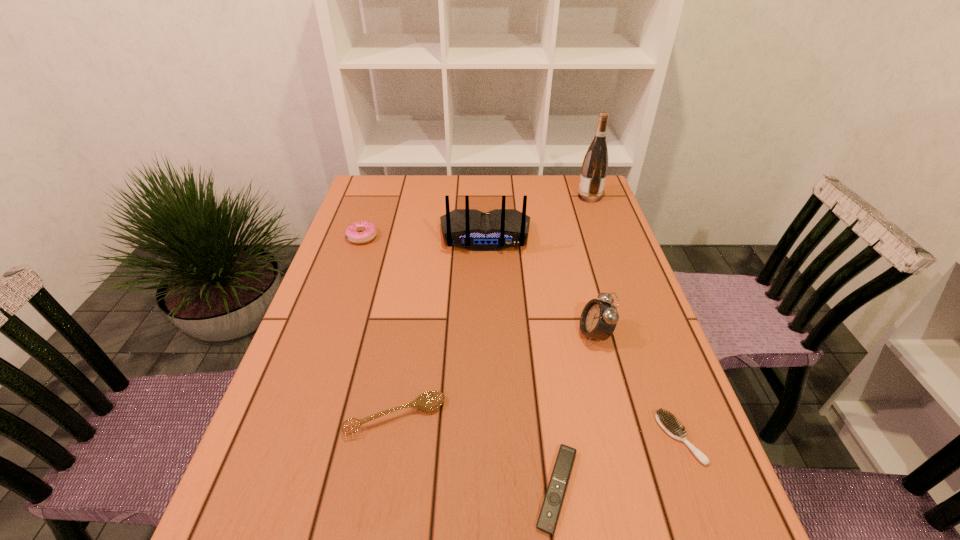
The height and width of the screenshot is (540, 960). In order to click on object that can be found as the sixth closest to the wine bottle in this screenshot , I will do `click(551, 507)`.

Image resolution: width=960 pixels, height=540 pixels. Identify the location of the closest object relative to the fourth nearest object. (667, 422).

You are a GUI agent. You are given a task and a screenshot of the screen. Output one action in this format:
    pyautogui.click(x=<x>, y=<y>)
    Task: Click on the vacant space that satisfies the following two spatial constraints: 1. on the back side of the scrubbing brush; 2. on the label of the tallest object
    The width and height of the screenshot is (960, 540).
    Given the screenshot: What is the action you would take?
    pyautogui.click(x=591, y=197)

What are the coordinates of `vacant space that satisfies the following two spatial constraints: 1. on the label of the farthest object; 2. on the back of the router` in the screenshot? It's located at (603, 235).

Locate an element on the screen. The height and width of the screenshot is (540, 960). vacant space that satisfies the following two spatial constraints: 1. on the face of the fourth farthest object; 2. on the left side of the scrubbing brush is located at coordinates (622, 438).

Where is `free point that satisfies the following two spatial constraints: 1. on the face of the fifth shortest object; 2. on the front side of the ladle`? The width and height of the screenshot is (960, 540). free point that satisfies the following two spatial constraints: 1. on the face of the fifth shortest object; 2. on the front side of the ladle is located at coordinates (616, 416).

You are a GUI agent. You are given a task and a screenshot of the screen. Output one action in this format:
    pyautogui.click(x=<x>, y=<y>)
    Task: Click on the free space that satisfies the following two spatial constraints: 1. on the label of the tallest object; 2. on the back of the second tallest object
    Image resolution: width=960 pixels, height=540 pixels.
    Given the screenshot: What is the action you would take?
    pyautogui.click(x=603, y=235)